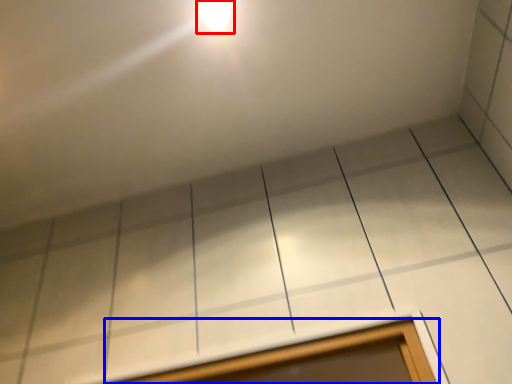
Question: Which of the following is the farthest to the observer, light fixture (highlighted by a red box) or window (highlighted by a blue box)?

Choices:
 (A) light fixture
 (B) window

Answer: (A)